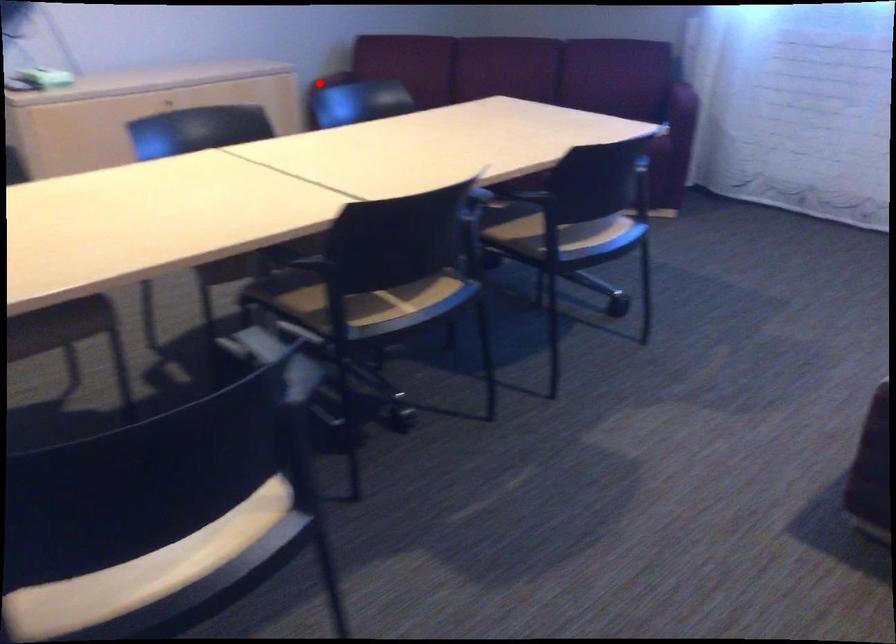
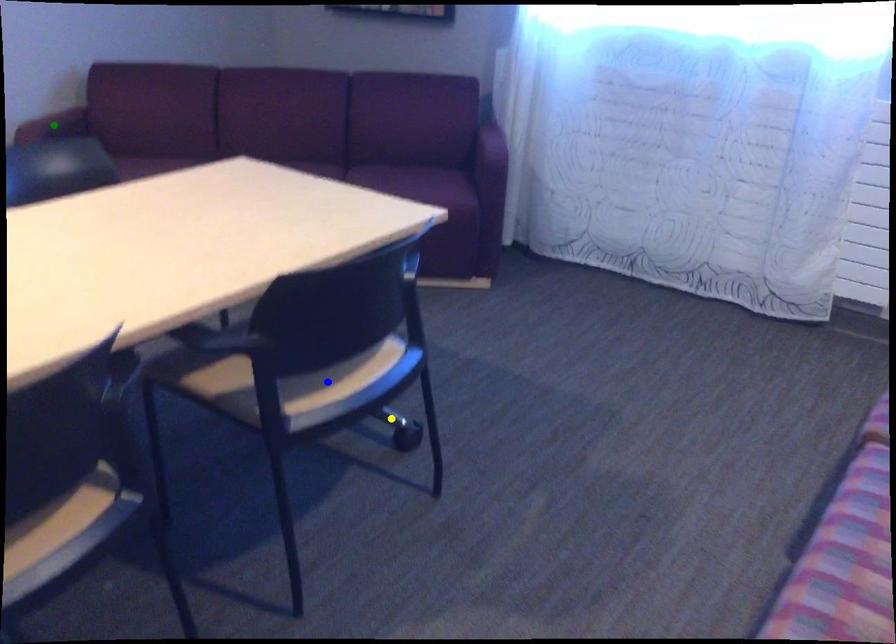
Question: I am providing you with two images of the same scene from different viewpoints. A red point is marked on the first image. You are given multiple points on the second image. In image 2, which mark is for the same physical point as the one in image 1?

Choices:
 (A) yellow point
 (B) green point
 (C) blue point

Answer: (B)